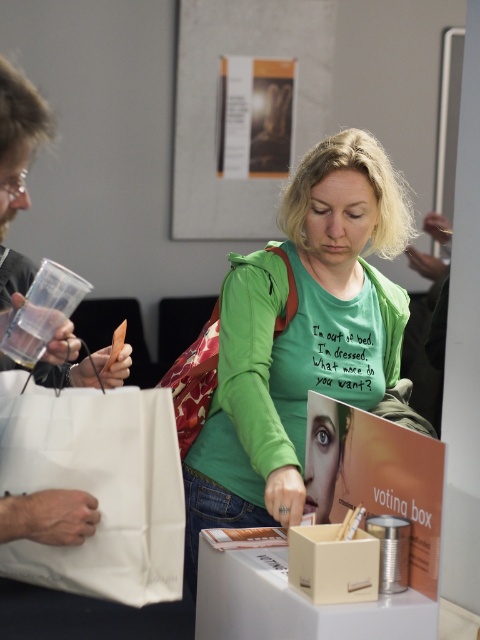
Does beige cardboard box at center have a greater height compared to printed fabric bag at center?

No.

Who is more forward, (350, 547) or (199, 360)?

Point (350, 547) is in front.

The image size is (480, 640). Identify the location of beige cardboard box at center. (333, 564).

Between white paper bag at lower left and white paper bag at left, which one appears on the left side from the viewer's perspective?

From the viewer's perspective, white paper bag at left appears more on the left side.

Who is positioned more to the right, white paper bag at lower left or white paper bag at left?

From the viewer's perspective, white paper bag at lower left appears more on the right side.

Locate an element on the screen. white paper bag at lower left is located at coordinates (97, 486).

Which of these two, green matte t-shirt at center or printed fabric bag at center, stands shorter?

Standing shorter between the two is printed fabric bag at center.

Who is more distant from viewer, (x=338, y=314) or (x=180, y=429)?

Positioned behind is point (x=180, y=429).

Describe the element at coordinates (301, 339) in the screenshot. I see `green matte t-shirt at center` at that location.

The height and width of the screenshot is (640, 480). What are the coordinates of `green matte t-shirt at center` in the screenshot? It's located at (301, 339).